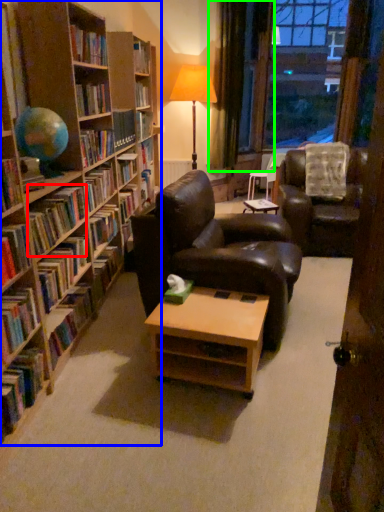
Question: Which is farther away from book (highlighted by a red box)? book (highlighted by a blue box) or curtain (highlighted by a green box)?

Choices:
 (A) book
 (B) curtain

Answer: (B)